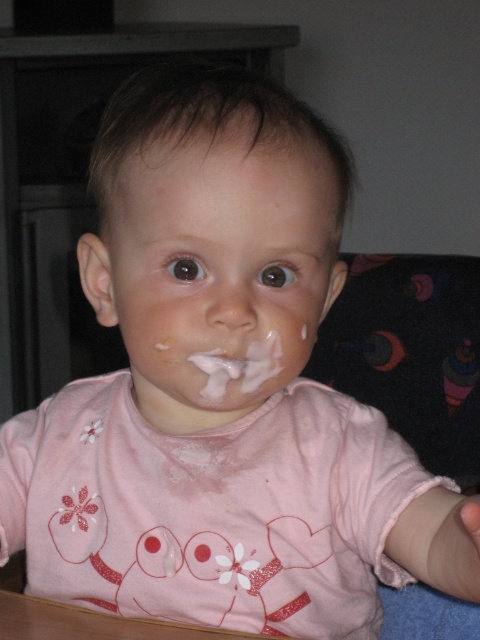
What are the coordinates of the white matte face at center?

The white matte face at center is located at coordinates 0.423 and 0.463.

The child has a white matte face at center and a white creamy frosting at mouth. Which one is bigger?

The white matte face at center is larger in size than the white creamy frosting at mouth.

The child has a white matte face at center and a white creamy frosting at mouth. Which one has a greater width?

The white matte face at center has a greater width than the white creamy frosting at mouth.